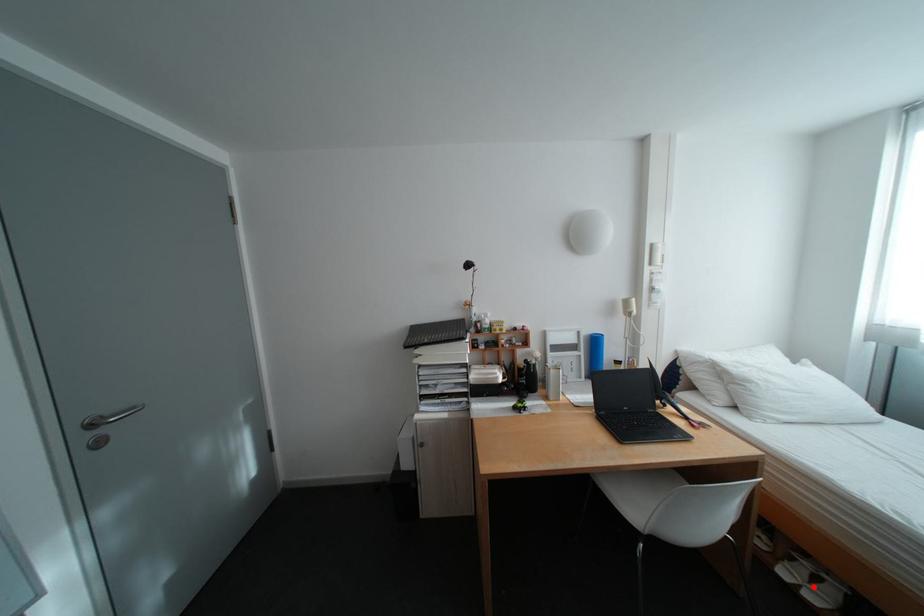
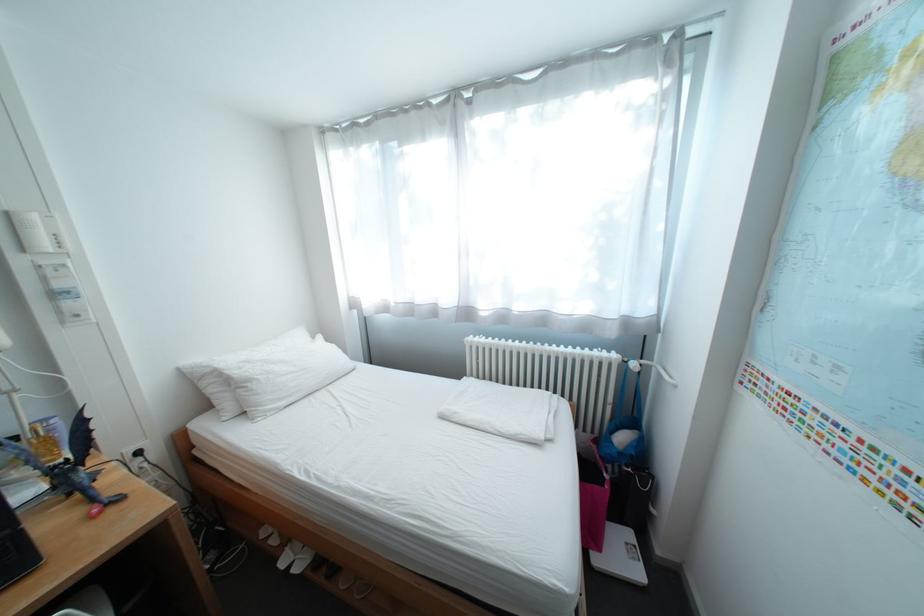
Find the pixel in the second image that matches the highlighted location in the first image.

(307, 562)